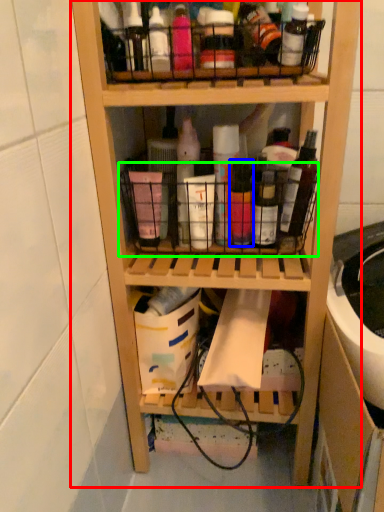
Question: Estimate the real-world distances between objects in this image. Which object is farther from shelf (highlighted by a red box), bottle (highlighted by a blue box) or basket (highlighted by a green box)?

Choices:
 (A) bottle
 (B) basket

Answer: (A)